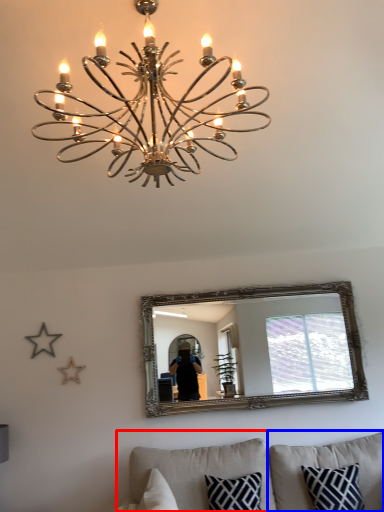
Question: Which object is closer to the camera taking this photo, studio couch (highlighted by a red box) or pillow (highlighted by a blue box)?

Choices:
 (A) studio couch
 (B) pillow

Answer: (A)